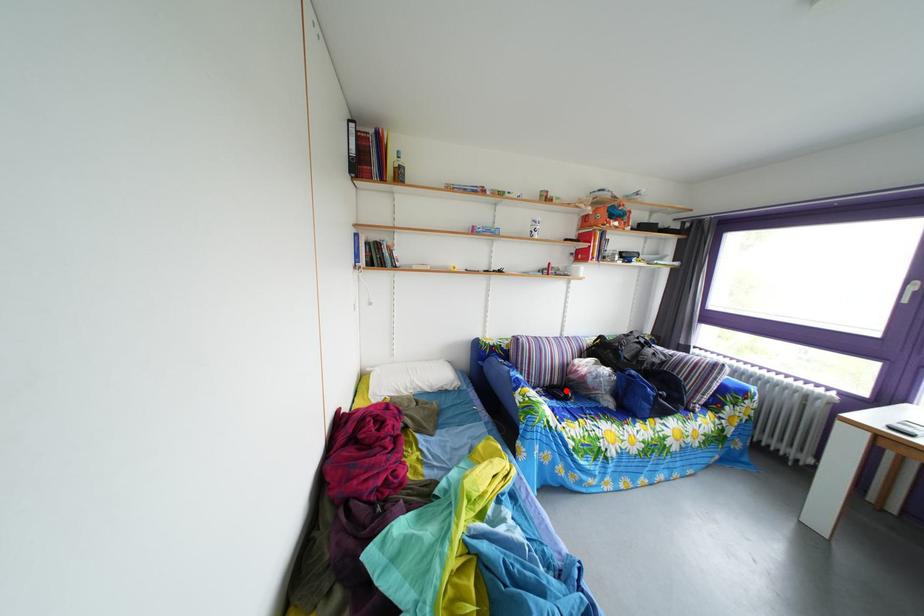
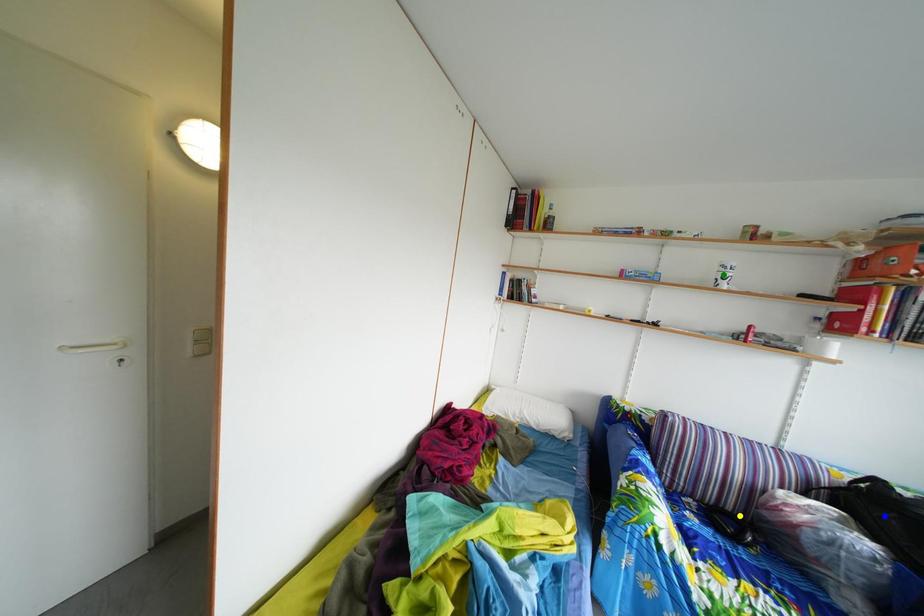
Question: I am providing you with two images of the same scene from different viewpoints. A red point is marked on the first image. You are given multiple points on the second image. Which mark in image 2 goes with the point in image 1?

Choices:
 (A) blue point
 (B) green point
 (C) yellow point

Answer: (C)